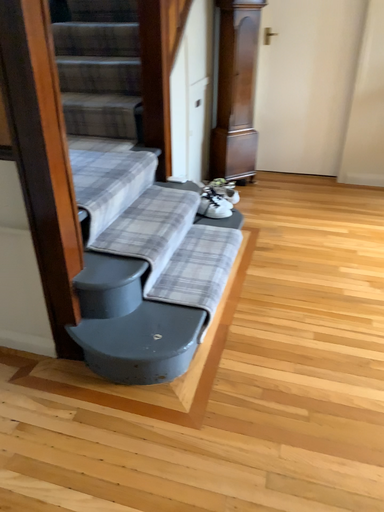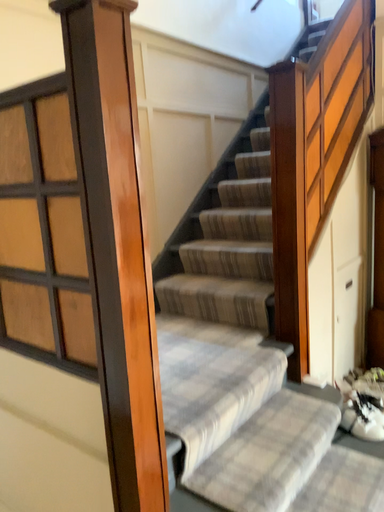
Question: How did the camera likely rotate when shooting the video?

Choices:
 (A) rotated right
 (B) rotated left

Answer: (B)